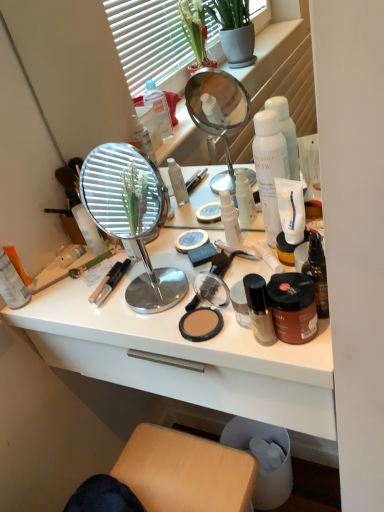
At what (x,y) coordinates should I click in order to perform the action: click on free space between silver/metallic mirror at center and matte black brush at lower left. Please return your answer as a coordinate pair (x, y). Image resolution: width=384 pixels, height=512 pixels. Looking at the image, I should click on (99, 281).